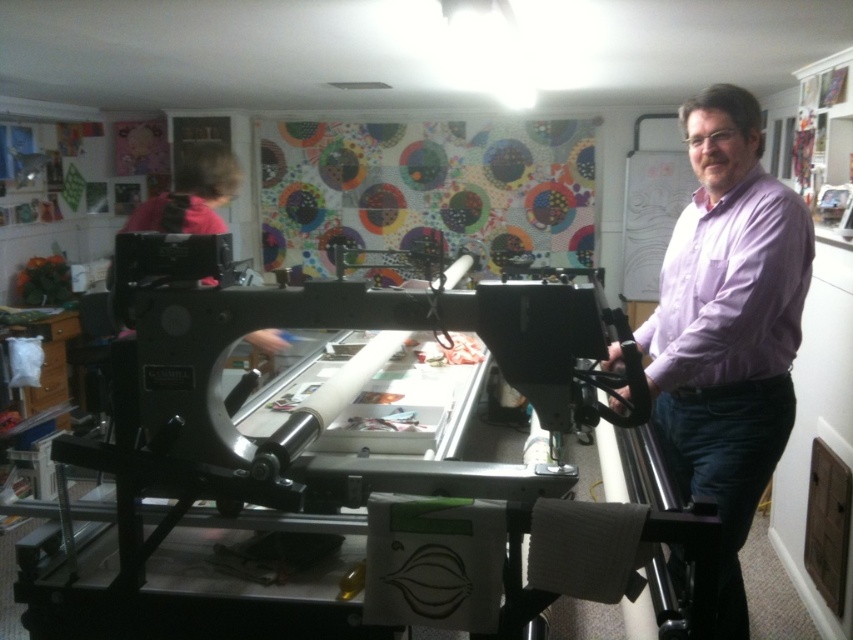
You are standing in the workspace and see the point marked at coordinate (318,465). Which object is this point located on?

The point marked at coordinate (318,465) is located on the metallic silver sewing machine at center.

You are a tailor working in this studio and need to determine which object is shorter between the metallic silver sewing machine at center and the purple cotton shirt at center. Can you identify the shorter one?

The metallic silver sewing machine at center is shorter than the purple cotton shirt at center, so the metallic silver sewing machine at center is the shorter object.